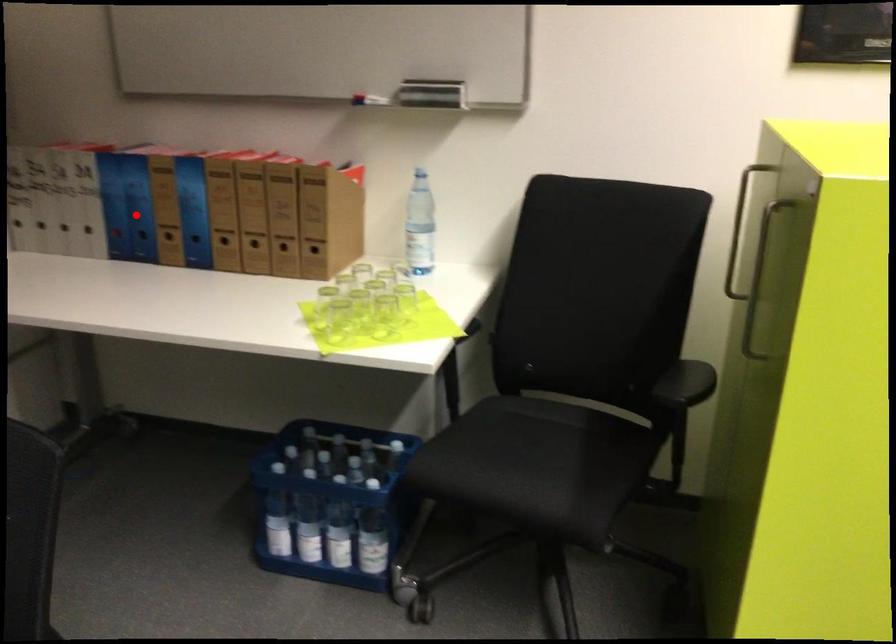
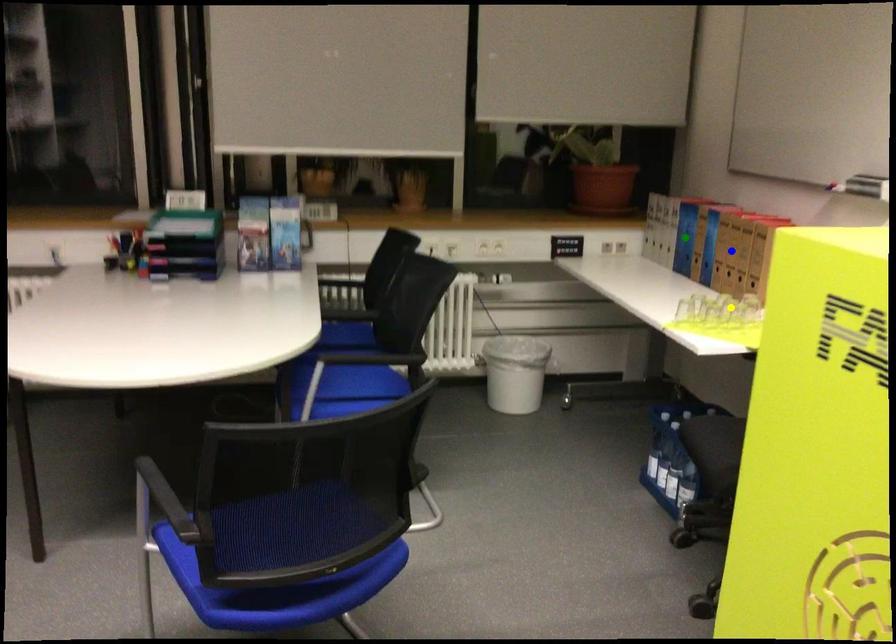
Question: I am providing you with two images of the same scene from different viewpoints. A red point is marked on the first image. You are given multiple points on the second image. Which mark in image 2 goes with the point in image 1?

Choices:
 (A) yellow point
 (B) green point
 (C) blue point

Answer: (B)